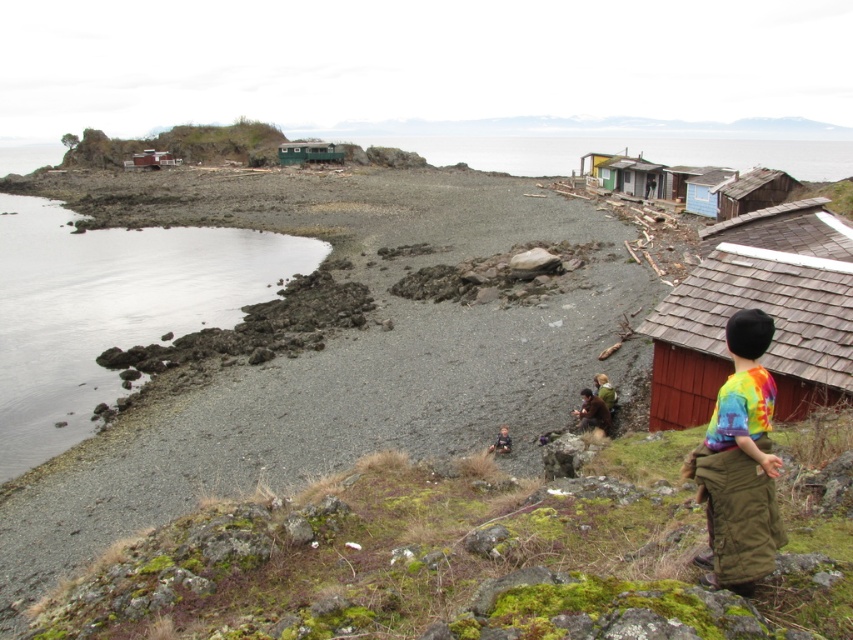
Question: Among these objects, which one is farthest from the camera?

Choices:
 (A) dark brown leather jacket at center
 (B) green fabric jacket at center

Answer: (B)

Question: Is wooden shack at center further to camera compared to rustic wooden hut at upper left?

Choices:
 (A) yes
 (B) no

Answer: (B)

Question: Is wooden shack at upper right wider than dark brown leather jacket at center?

Choices:
 (A) no
 (B) yes

Answer: (B)

Question: Which point appears farthest from the camera in this image?

Choices:
 (A) (173, 320)
 (B) (595, 388)

Answer: (A)

Question: Among these points, which one is nearest to the camera?

Choices:
 (A) (80, 310)
 (B) (125, 168)
 (C) (688, 198)
 (D) (740, 312)

Answer: (D)

Question: Does blue wooden hut at upper right have a greater width compared to green weathered wood hut at center?

Choices:
 (A) no
 (B) yes

Answer: (A)